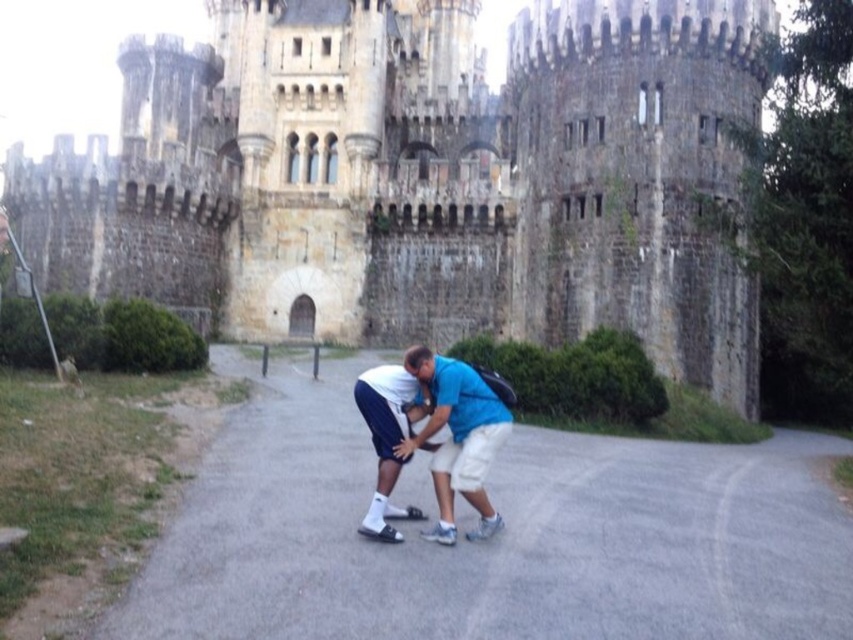
You are standing in front of the stone castle at center and the white matte shorts at center. Which object is positioned to the right side?

The white matte shorts at center is positioned to the right of the stone castle at center.

You are a photographer standing at the castle entrance. You want to take a photo of both the point at coordinates point (602, 236) and point (462, 472). Which point should you focus on first if you want to ensure both are in focus?

You should focus on point (602, 236) first because it is closer to the camera than point (462, 472). By focusing on the closer point, the farther point will also be within the depth of field, ensuring both are in focus.